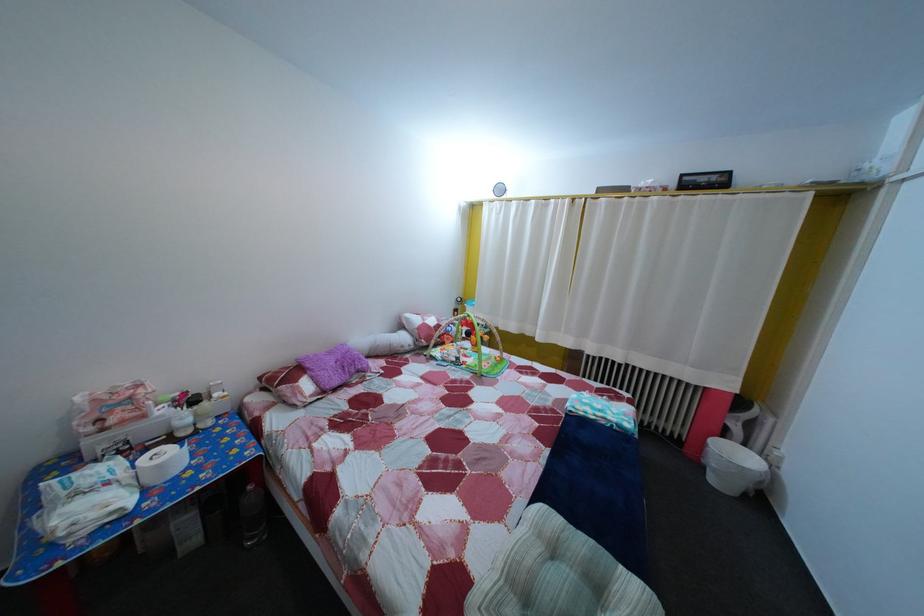
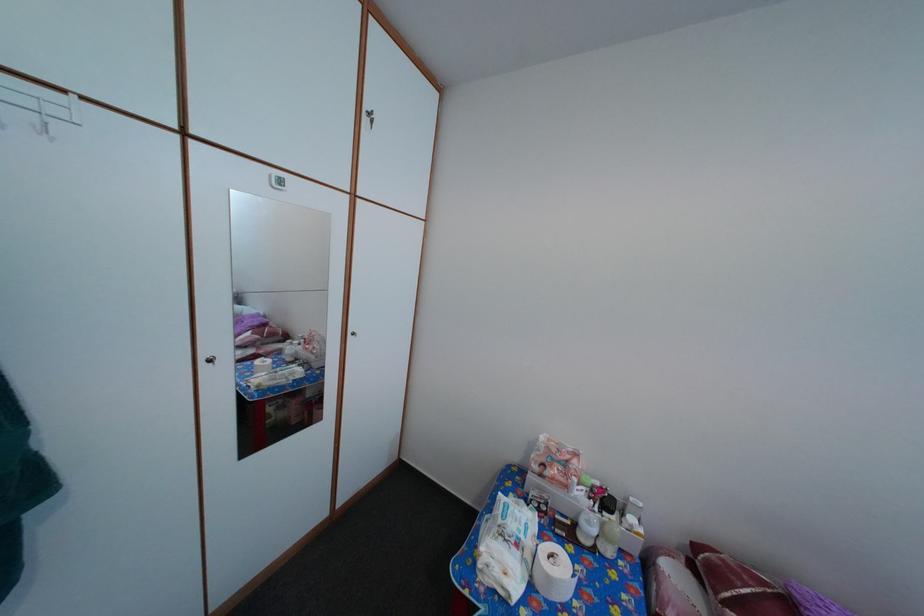
Locate, in the second image, the point that corresponds to [271,387] in the first image.

(704, 554)